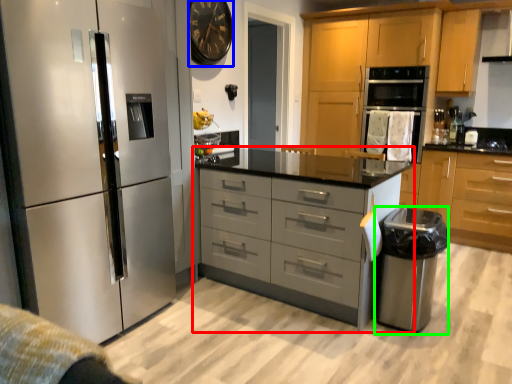
Question: Estimate the real-world distances between objects in this image. Which object is closer to chest of drawers (highlighted by a red box), clock (highlighted by a blue box) or appliance (highlighted by a green box)?

Choices:
 (A) clock
 (B) appliance

Answer: (B)